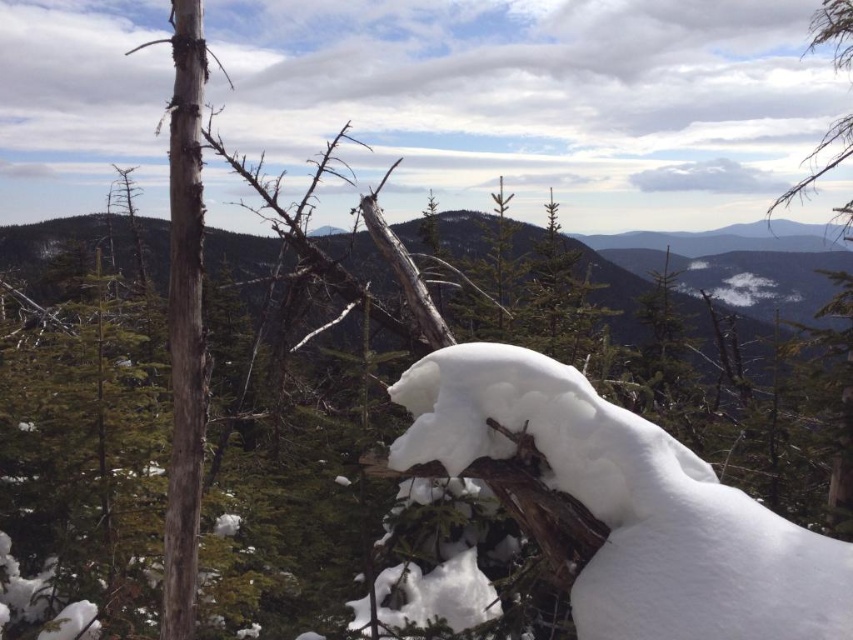
You are a hiker trying to navigate through the snowy forest. You see the white fluffy snow at center and the green matte tree at upper center. Which object is closer to the ground?

The white fluffy snow at center is closer to the ground because it is shorter than the green matte tree at upper center.